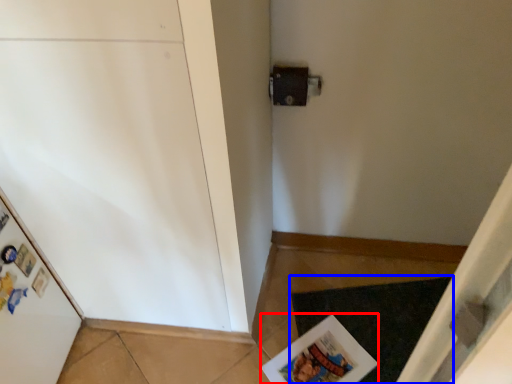
Question: Among these objects, which one is nearest to the camera, magazine (highlighted by a red box) or doormat (highlighted by a blue box)?

Choices:
 (A) magazine
 (B) doormat

Answer: (A)